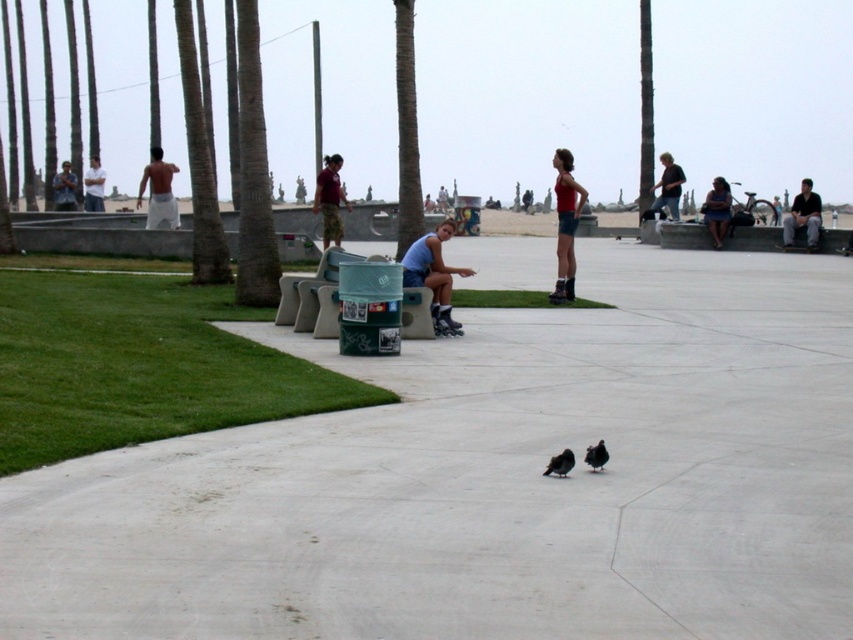
This screenshot has height=640, width=853. Identify the location of maroon fabric shirt at upper center. (329, 198).

At what (x,y) coordinates should I click in order to perform the action: click on maroon fabric shirt at upper center. Please return your answer as a coordinate pair (x, y). This screenshot has width=853, height=640. Looking at the image, I should click on (329, 198).

Does green leafy palm tree at center appear over dark gray matte pigeon at center?

Indeed, green leafy palm tree at center is positioned over dark gray matte pigeon at center.

Is point (396, 259) more distant than point (572, 460)?

Yes, it is.

Measure the distance between point (408, 192) and camera.

23.15 meters

Image resolution: width=853 pixels, height=640 pixels. What are the coordinates of `green leafy palm tree at center` in the screenshot? It's located at (405, 131).

How far apart are green textured palm tree at left and green leafy palm tree at center?

They are 5.93 meters apart.

Can you confirm if green textured palm tree at left is taller than green leafy palm tree at center?

In fact, green textured palm tree at left may be shorter than green leafy palm tree at center.

Does point (260, 113) lie behind point (408, 122)?

No.

I want to click on green textured palm tree at left, so click(x=253, y=172).